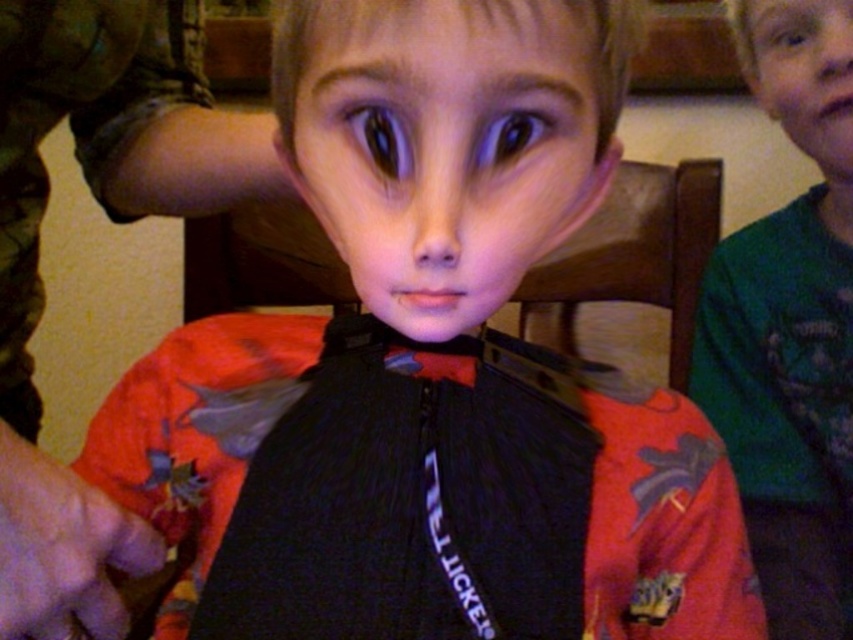
You are a tailor measuring shirts for a customer. You have two shirts available in the image, the green matte shirt at upper right and the smooth green shirt at upper right. The customer wants to know which one has a larger width. Can you determine this based on the image?

The green matte shirt at upper right might be wider than smooth green shirt at upper right according to the image description.

You are a photographer adjusting your camera settings. You notice the matte black strap at center and the green matte shirt at upper right in your viewfinder. Which object is located more to the left in the frame?

The matte black strap at center is positioned on the left side of the green matte shirt at upper right, so it is more to the left in the frame.